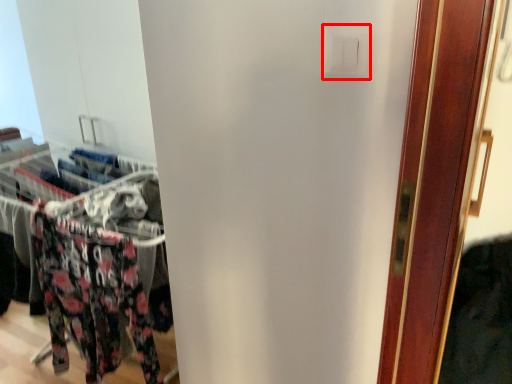
Question: From the image's perspective, where is light switch (annotated by the red box) located in relation to closet in the image?

Choices:
 (A) above
 (B) below

Answer: (A)